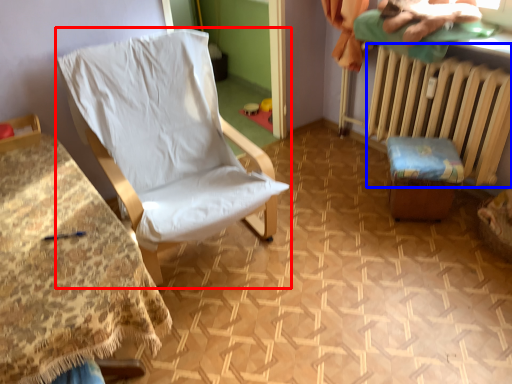
Question: Which object appears farthest to the camera in this image, chair (highlighted by a red box) or radiator (highlighted by a blue box)?

Choices:
 (A) chair
 (B) radiator

Answer: (B)